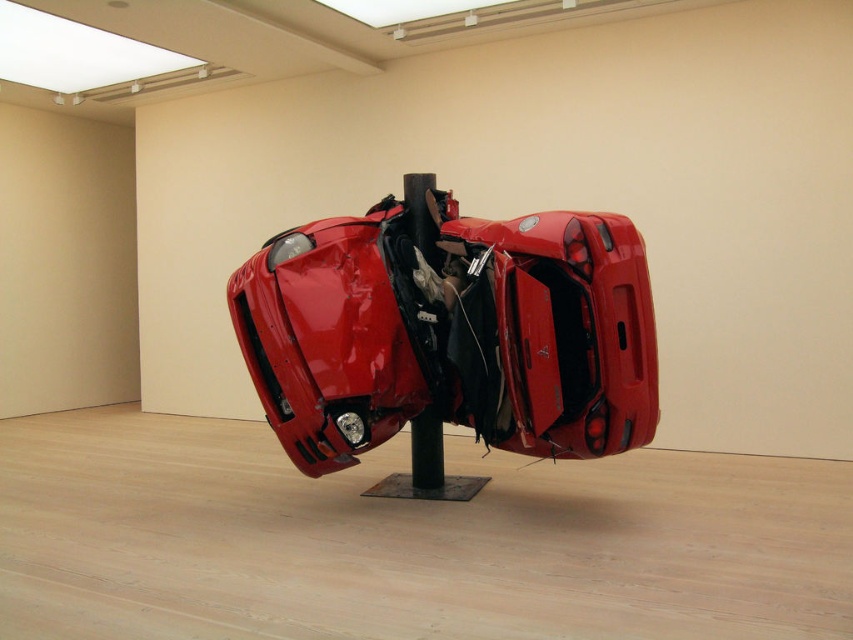
Which is below, glossy red car at center or black matte pole at center?

Positioned lower is black matte pole at center.

Does point (463, 413) come in front of point (437, 420)?

Yes.

Where is `glossy red car at center`? glossy red car at center is located at coordinates (450, 332).